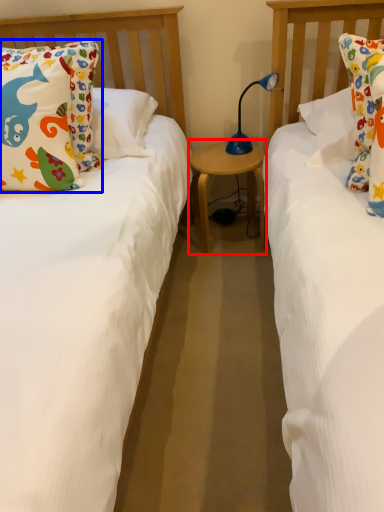
Question: Among these objects, which one is farthest to the camera, table (highlighted by a red box) or pillow (highlighted by a blue box)?

Choices:
 (A) table
 (B) pillow

Answer: (A)